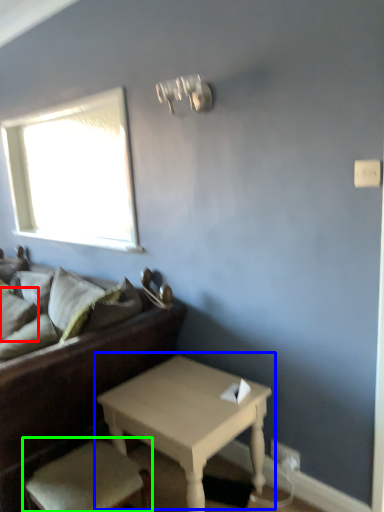
Question: Which object is the farthest from pillow (highlighted by a red box)? Choose among these: table (highlighted by a blue box) or armchair (highlighted by a green box).

Choices:
 (A) table
 (B) armchair

Answer: (A)